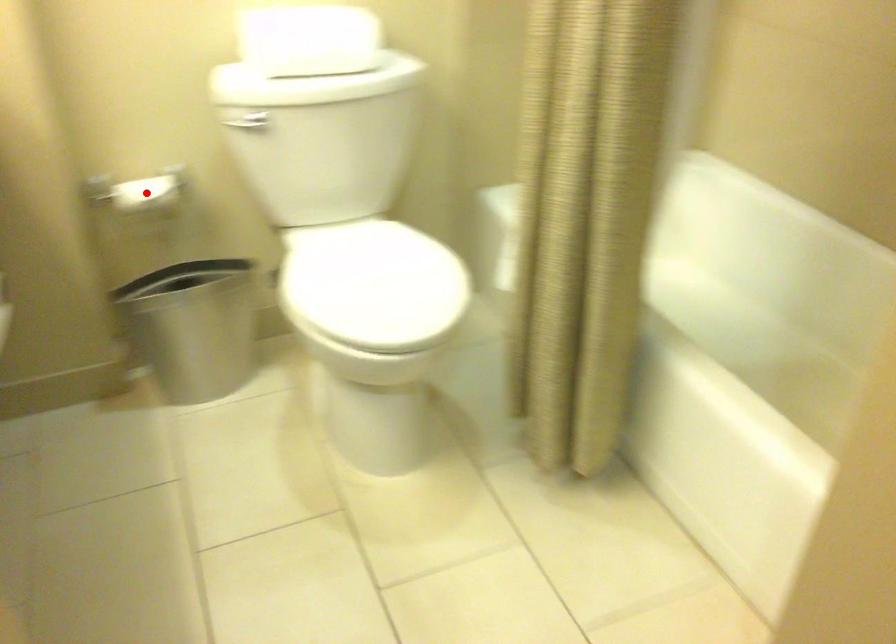
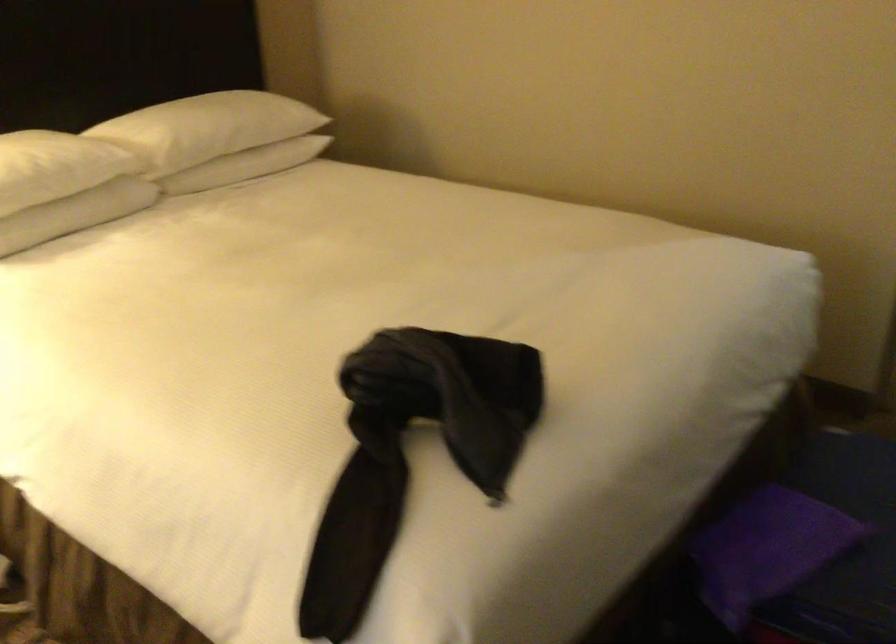
Question: I am providing you with two images of the same scene from different viewpoints. A red point is marked on the first image. At the location where the point appears in image 1, is it still visible in image 2?

Choices:
 (A) Yes
 (B) No

Answer: (B)